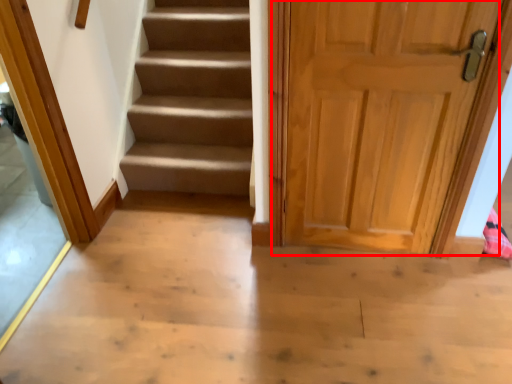
Question: From the image's perspective, what is the correct spatial relationship of door (annotated by the red box) in relation to glass door?

Choices:
 (A) above
 (B) below

Answer: (A)